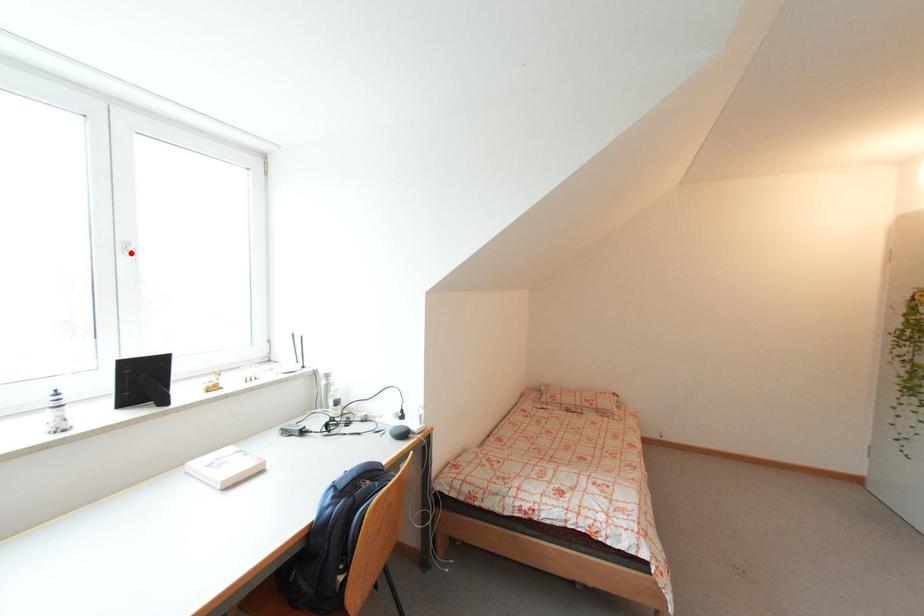
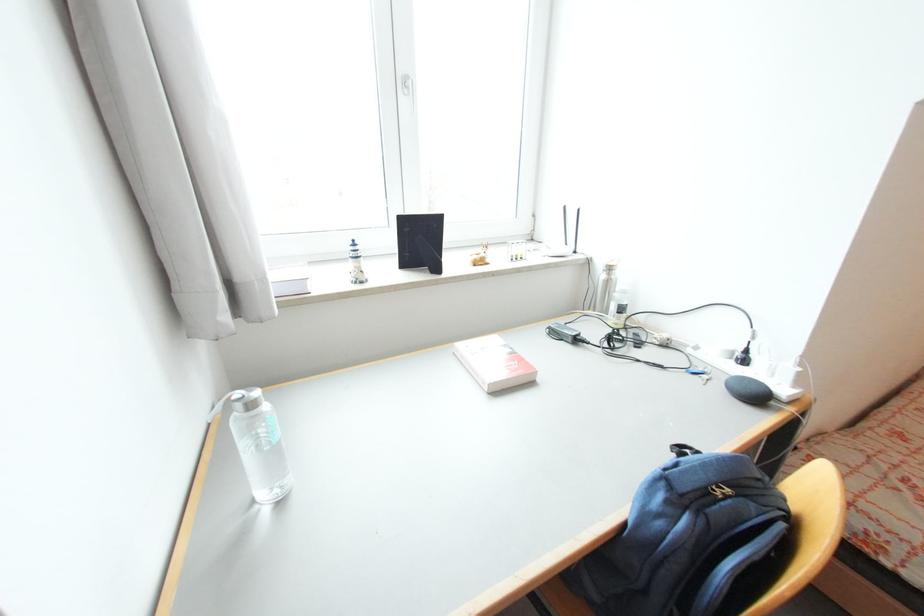
Find the pixel in the second image that matches the highlighted location in the first image.

(411, 91)